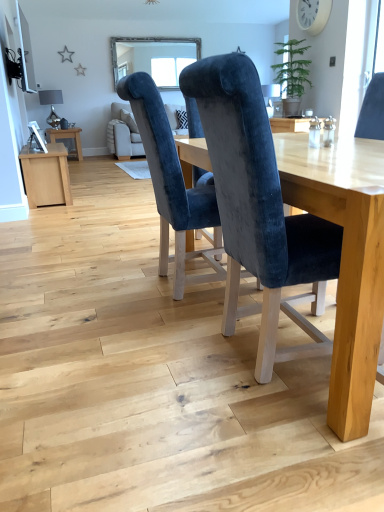
Where is `velvet blue chair at center, the first chair positioned from the right`? velvet blue chair at center, the first chair positioned from the right is located at coordinates (x=256, y=189).

What do you see at coordinates (171, 183) in the screenshot? Image resolution: width=384 pixels, height=512 pixels. I see `velvet blue chair at center, acting as the 1th chair starting from the left` at bounding box center [171, 183].

The height and width of the screenshot is (512, 384). What are the coordinates of `clear glass window at upper center` in the screenshot? It's located at (154, 58).

What do you see at coordinates (154, 58) in the screenshot? The height and width of the screenshot is (512, 384). I see `clear glass window at upper center` at bounding box center [154, 58].

The image size is (384, 512). What do you see at coordinates (67, 139) in the screenshot? I see `wooden side table at left` at bounding box center [67, 139].

Where is `velvet blue chair at center, the second chair in the left-to-right sequence`? The height and width of the screenshot is (512, 384). velvet blue chair at center, the second chair in the left-to-right sequence is located at coordinates click(256, 189).

Consider the image. Would you say wooden side table at left is to the left or to the right of velvet blue chair at center, the second chair in the left-to-right sequence, in the picture?

In the image, wooden side table at left appears on the left side of velvet blue chair at center, the second chair in the left-to-right sequence.

Does wooden side table at left have a greater height compared to velvet blue chair at center, the second chair in the left-to-right sequence?

Incorrect, the height of wooden side table at left is not larger of that of velvet blue chair at center, the second chair in the left-to-right sequence.

Consider the image. What's the angular difference between wooden side table at left and velvet blue chair at center, the second chair in the left-to-right sequence,'s facing directions?

wooden side table at left and velvet blue chair at center, the second chair in the left-to-right sequence, are facing 1.87 degrees away from each other.

Could you tell me if wooden side table at left is facing velvet blue chair at center, the first chair positioned from the right?

No.

From a real-world perspective, which is physically above, velvet blue chair at center, acting as the 1th chair starting from the left, or wooden side table at left?

velvet blue chair at center, acting as the 1th chair starting from the left.

In the scene shown: Can we say velvet blue chair at center, the second chair from the right, lies outside wooden side table at left?

velvet blue chair at center, the second chair from the right, lies outside wooden side table at left's area.

You are a GUI agent. You are given a task and a screenshot of the screen. Output one action in this format:
    pyautogui.click(x=<x>, y=<y>)
    Task: Click on the table above the velvet blue chair at center, acting as the 1th chair starting from the left (from the image's perspective)
    The height and width of the screenshot is (512, 384).
    Given the screenshot: What is the action you would take?
    pyautogui.click(x=67, y=139)

Is point (121, 67) farther from camera compared to point (167, 120)?

Yes, it is.

Would you consider clear glass window at upper center to be distant from velvet blue chair at center, acting as the 1th chair starting from the left?

clear glass window at upper center is positioned a significant distance from velvet blue chair at center, acting as the 1th chair starting from the left.

Which object is wider, clear glass window at upper center or velvet blue chair at center, the second chair from the right?

velvet blue chair at center, the second chair from the right.

From the image's perspective, between clear glass window at upper center and velvet blue chair at center, acting as the 1th chair starting from the left, who is located below?

velvet blue chair at center, acting as the 1th chair starting from the left, is shown below in the image.

Considering the points (229, 222) and (57, 137), which point is behind, point (229, 222) or point (57, 137)?

The point (57, 137) is farther.

Are velvet blue chair at center, the second chair in the left-to-right sequence, and wooden side table at left far apart?

Yes.

In terms of size, does velvet blue chair at center, the first chair positioned from the right, appear bigger or smaller than wooden side table at left?

In the image, velvet blue chair at center, the first chair positioned from the right, appears to be larger than wooden side table at left.

Can you tell me how much velvet blue chair at center, the second chair in the left-to-right sequence, and wooden side table at left differ in facing direction?

The angle between the facing direction of velvet blue chair at center, the second chair in the left-to-right sequence, and the facing direction of wooden side table at left is 1.87 degrees.

Which point is more distant from viewer, (138, 65) or (337, 266)?

Point (138, 65)

From a real-world perspective, which chair is the 2nd one underneath the clear glass window at upper center? Please provide its 2D coordinates.

[(256, 189)]

Can you confirm if clear glass window at upper center is thinner than velvet blue chair at center, the second chair in the left-to-right sequence?

Yes.

How different are the orientations of velvet blue chair at center, acting as the 1th chair starting from the left, and velvet blue chair at center, the first chair positioned from the right, in degrees?

0.000254 degrees.

From the picture: Between velvet blue chair at center, acting as the 1th chair starting from the left, and velvet blue chair at center, the first chair positioned from the right, which one has more height?

Standing taller between the two is velvet blue chair at center, the first chair positioned from the right.

Is velvet blue chair at center, the second chair from the right, oriented towards velvet blue chair at center, the first chair positioned from the right?

No, velvet blue chair at center, the second chair from the right, is not aimed at velvet blue chair at center, the first chair positioned from the right.

Who is bigger, velvet blue chair at center, acting as the 1th chair starting from the left, or velvet blue chair at center, the second chair in the left-to-right sequence?

With larger size is velvet blue chair at center, the second chair in the left-to-right sequence.

From the image's perspective, is velvet blue chair at center, the first chair positioned from the right, on velvet blue chair at center, acting as the 1th chair starting from the left?

Incorrect, from the image's perspective, velvet blue chair at center, the first chair positioned from the right, is lower than velvet blue chair at center, acting as the 1th chair starting from the left.

Looking at this image, does velvet blue chair at center, the first chair positioned from the right, have a lesser width compared to velvet blue chair at center, the second chair from the right?

No.

Find the location of `chair on the left of velvet blue chair at center, the second chair in the left-to-right sequence`. chair on the left of velvet blue chair at center, the second chair in the left-to-right sequence is located at coordinates (171, 183).

The image size is (384, 512). Identify the location of chair that is the 2nd one when counting rightward from the wooden side table at left. (256, 189).

At what (x,y) coordinates should I click in order to perform the action: click on the 1st chair below when counting from the wooden side table at left (from the image's perspective). Please return your answer as a coordinate pair (x, y). The image size is (384, 512). Looking at the image, I should click on pos(171,183).

Considering their positions, is wooden side table at left positioned closer to velvet blue chair at center, the second chair in the left-to-right sequence, than velvet blue chair at center, the second chair from the right?

The object closer to velvet blue chair at center, the second chair in the left-to-right sequence, is velvet blue chair at center, the second chair from the right.

Based on their spatial positions, is wooden side table at left or clear glass window at upper center closer to velvet blue chair at center, the second chair in the left-to-right sequence?

Based on the image, wooden side table at left appears to be nearer to velvet blue chair at center, the second chair in the left-to-right sequence.

When comparing their distances from wooden side table at left, does velvet blue chair at center, the second chair from the right, or velvet blue chair at center, the first chair positioned from the right, seem closer?

velvet blue chair at center, the second chair from the right, is closer to wooden side table at left.

Estimate the real-world distances between objects in this image. Which object is closer to wooden side table at left, velvet blue chair at center, the second chair from the right, or clear glass window at upper center?

Based on the image, clear glass window at upper center appears to be nearer to wooden side table at left.

When comparing their distances from clear glass window at upper center, does wooden side table at left or velvet blue chair at center, the second chair in the left-to-right sequence, seem further?

Among the two, velvet blue chair at center, the second chair in the left-to-right sequence, is located further to clear glass window at upper center.

From the image, which object appears to be nearer to velvet blue chair at center, acting as the 1th chair starting from the left, velvet blue chair at center, the first chair positioned from the right, or wooden side table at left?

Based on the image, velvet blue chair at center, the first chair positioned from the right, appears to be nearer to velvet blue chair at center, acting as the 1th chair starting from the left.

Looking at the image, which one is located closer to wooden side table at left, velvet blue chair at center, the second chair in the left-to-right sequence, or velvet blue chair at center, the second chair from the right?

velvet blue chair at center, the second chair from the right.

Based on their spatial positions, is clear glass window at upper center or velvet blue chair at center, the second chair from the right, closer to wooden side table at left?

The object closer to wooden side table at left is clear glass window at upper center.

Locate an element on the screen. The image size is (384, 512). table positioned between velvet blue chair at center, the first chair positioned from the right, and clear glass window at upper center from near to far is located at coordinates (67, 139).

At what (x,y) coordinates should I click in order to perform the action: click on chair positioned between velvet blue chair at center, the first chair positioned from the right, and clear glass window at upper center from near to far. Please return your answer as a coordinate pair (x, y). Looking at the image, I should click on (171, 183).

At what (x,y) coordinates should I click in order to perform the action: click on chair located between velvet blue chair at center, the second chair in the left-to-right sequence, and wooden side table at left in the depth direction. Please return your answer as a coordinate pair (x, y). Looking at the image, I should click on (171, 183).

Image resolution: width=384 pixels, height=512 pixels. I want to click on table located between velvet blue chair at center, acting as the 1th chair starting from the left, and clear glass window at upper center in the depth direction, so click(67, 139).